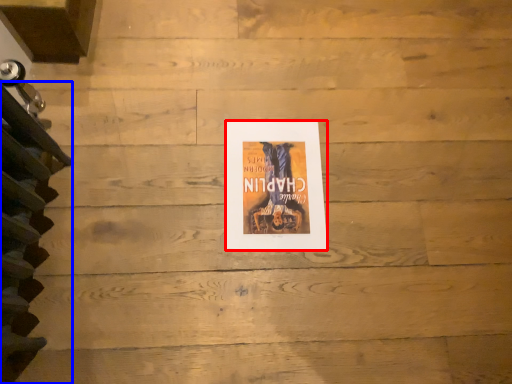
Question: Which object appears closest to the camera in this image, poster (highlighted by a red box) or stairwell (highlighted by a blue box)?

Choices:
 (A) poster
 (B) stairwell

Answer: (B)